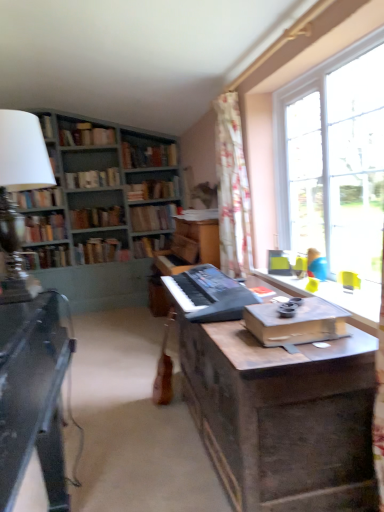
Question: Is hardcover book at left, arranged as the 8th book when viewed from the top, oriented away from wooden bookshelf at left?

Choices:
 (A) yes
 (B) no

Answer: (B)

Question: Is hardcover book at left, arranged as the 8th book when viewed from the top, at the left side of wooden bookshelf at left?

Choices:
 (A) yes
 (B) no

Answer: (A)

Question: From a real-world perspective, is hardcover book at left, positioned as the 4th book in bottom-to-top order, positioned under wooden bookshelf at left based on gravity?

Choices:
 (A) yes
 (B) no

Answer: (A)

Question: Could you tell me if hardcover book at left, arranged as the 8th book when viewed from the top, is turned towards wooden bookshelf at left?

Choices:
 (A) no
 (B) yes

Answer: (B)

Question: Is hardcover book at left, positioned as the 4th book in bottom-to-top order, behind wooden bookshelf at left?

Choices:
 (A) no
 (B) yes

Answer: (B)

Question: Is hardcover book at left, positioned as the 4th book in bottom-to-top order, smaller than wooden bookshelf at left?

Choices:
 (A) yes
 (B) no

Answer: (A)

Question: From the image's perspective, is black matte keyboard at center below clear glass window at upper right?

Choices:
 (A) yes
 (B) no

Answer: (A)

Question: Is the position of black matte keyboard at center more distant than that of clear glass window at upper right?

Choices:
 (A) no
 (B) yes

Answer: (B)

Question: Can you confirm if black matte keyboard at center is shorter than clear glass window at upper right?

Choices:
 (A) no
 (B) yes

Answer: (B)

Question: Is black matte keyboard at center not close to clear glass window at upper right?

Choices:
 (A) yes
 (B) no

Answer: (B)

Question: Could clear glass window at upper right be considered to be inside black matte keyboard at center?

Choices:
 (A) yes
 (B) no

Answer: (B)

Question: Considering the relative sizes of black matte keyboard at center and clear glass window at upper right in the image provided, is black matte keyboard at center wider than clear glass window at upper right?

Choices:
 (A) no
 (B) yes

Answer: (B)

Question: Is hardcover book at center-left, the 10th book in the top-to-bottom sequence, beside hardcover book at center, which is the sixth book in top-to-bottom order?

Choices:
 (A) no
 (B) yes

Answer: (A)